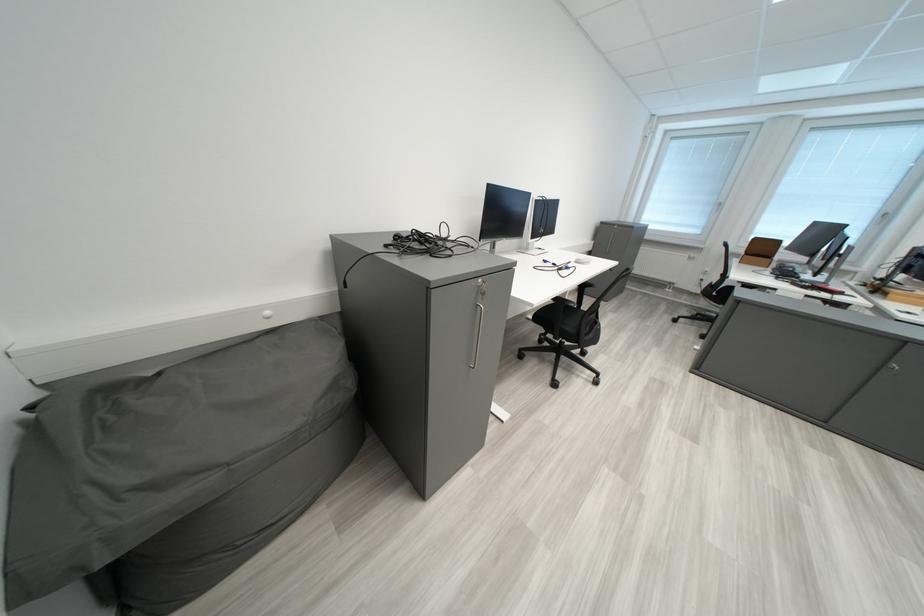
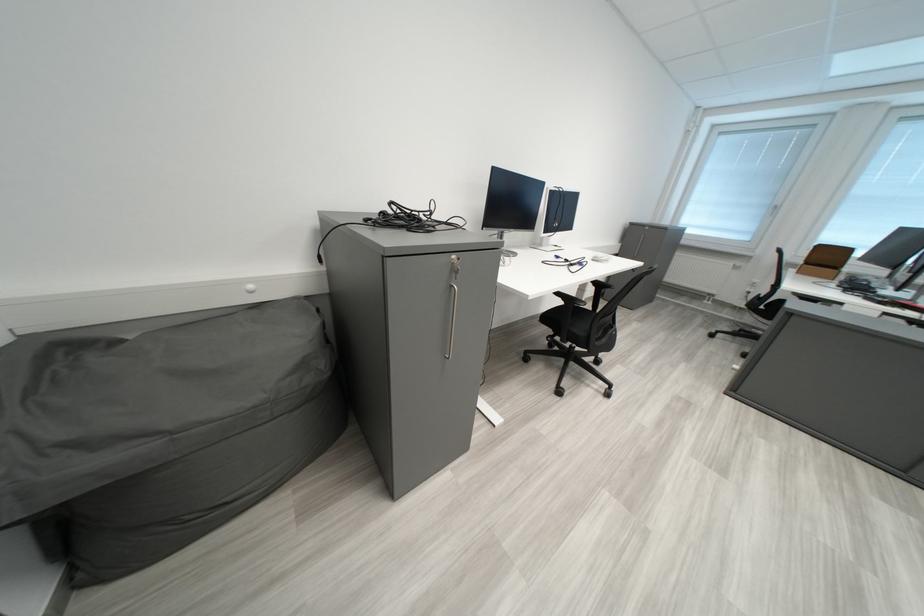
Question: How did the camera likely rotate?

Choices:
 (A) Left
 (B) Right
 (C) Up
 (D) Down

Answer: (A)